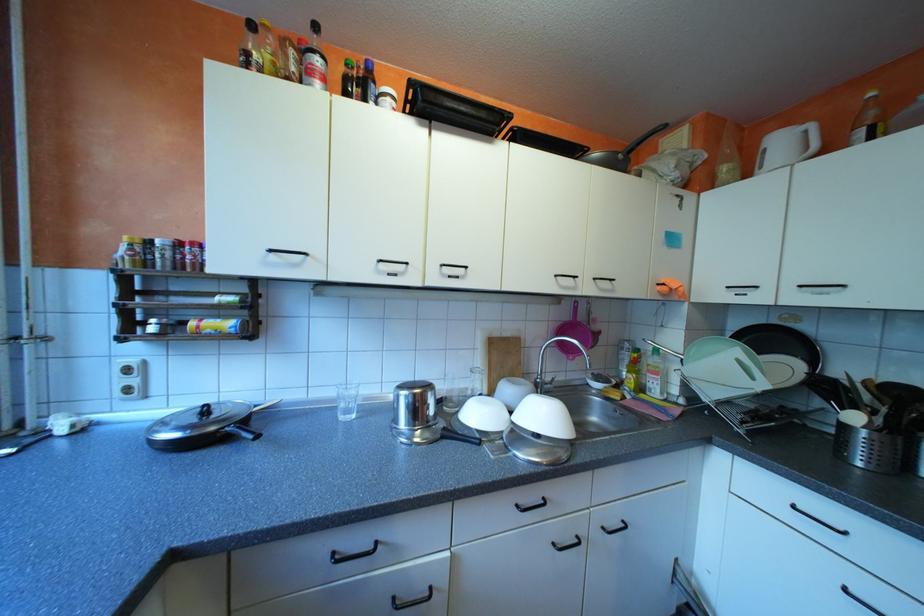
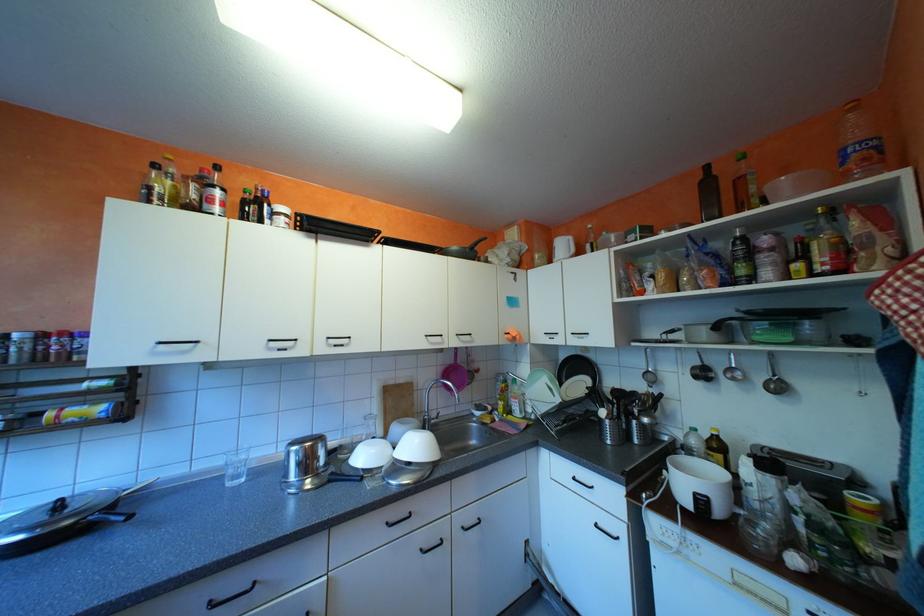
Where in the second image is the point corresponding to point (542, 384) from the first image?

(428, 422)